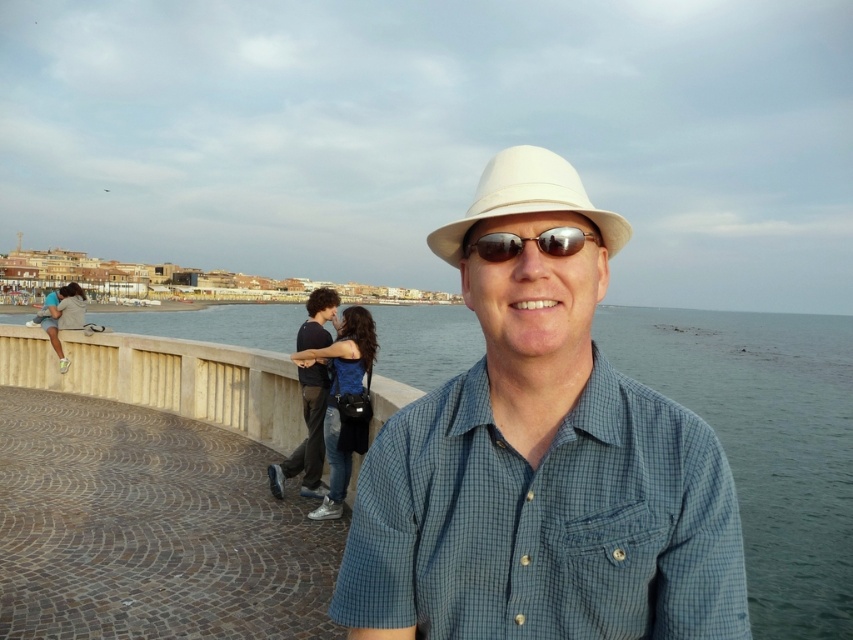
Question: Which object appears closest to the camera in this image?

Choices:
 (A) sunglasses at center
 (B) dark blue jeans at center
 (C) white matte hat at center

Answer: (C)

Question: Based on their relative distances, which object is farther from the sunglasses at center?

Choices:
 (A) dark blue jeans at center
 (B) clear blue water at center
 (C) white matte hat at center

Answer: (B)

Question: Is white matte hat at center thinner than clear blue water at center?

Choices:
 (A) yes
 (B) no

Answer: (A)

Question: Where is denim jeans at center located in relation to dark blue jeans at center in the image?

Choices:
 (A) above
 (B) below

Answer: (B)

Question: Can you confirm if white matte hat at center is wider than white matte fedora at center?

Choices:
 (A) yes
 (B) no

Answer: (B)

Question: Which is nearer to the white matte hat at center?

Choices:
 (A) clear blue water at center
 (B) dark blue jeans at center

Answer: (B)